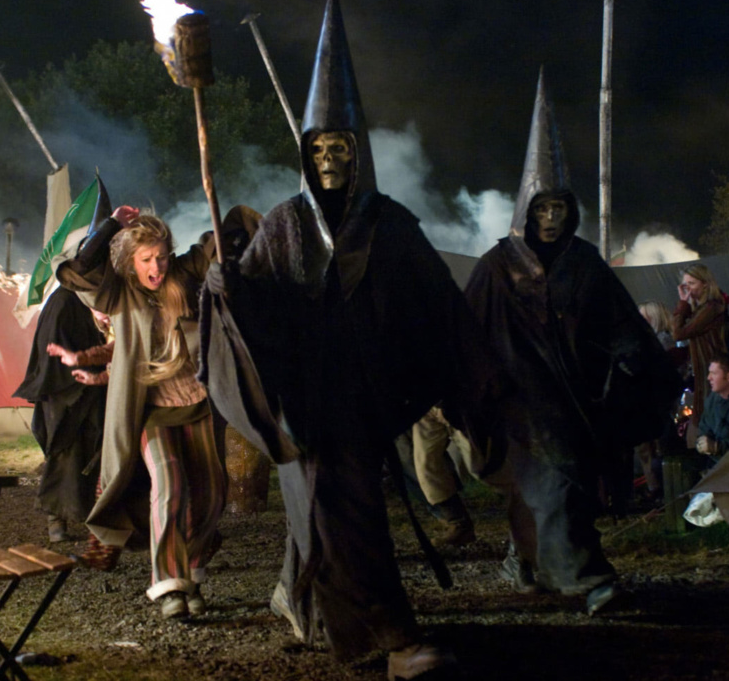
The width and height of the screenshot is (729, 681). I want to click on table, so click(x=25, y=547).